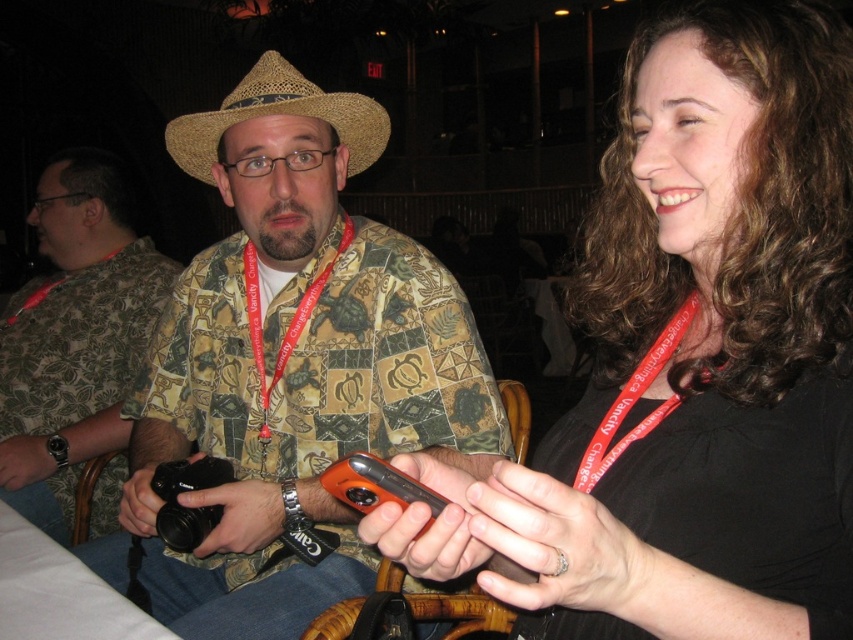
You are a photographer trying to capture a candid shot of the two people at the table. You notice the matte black phone at center and the strawhat at center. Which object is positioned to the right of the other?

The matte black phone at center is to the right of the strawhat at center.

You are a photographer who needs to choose between the matte black phone at center and the matte black camera at center for a quick photo shoot. Which device is more portable due to its size?

The matte black phone at center is thinner than the matte black camera at center, making it more portable for a quick photo shoot.